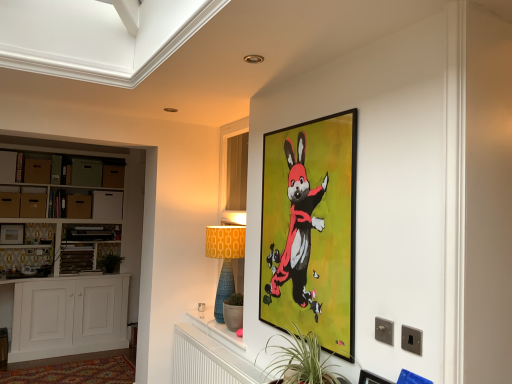
Question: In terms of height, does matte brown drawer at left, the sixth drawer from the right, look taller or shorter compared to green leafy plant at lower center?

Choices:
 (A) short
 (B) tall

Answer: (A)

Question: Looking at their shapes, would you say matte brown drawer at left, acting as the 2th drawer starting from the left, is wider or thinner than green leafy plant at lower center?

Choices:
 (A) thin
 (B) wide

Answer: (B)

Question: Considering the real-world distances, which object is farthest from the blue textured lamp at center?

Choices:
 (A) matte black picture frame at left, which appears as the 3th picture frame when viewed from the right
 (B) matte black picture frame at upper right, arranged as the 1th picture frame when viewed from the front
 (C) matte cardboard drawer at upper left, acting as the third drawer starting from the left
 (D) green leafy plant at lower center
 (E) green cardboard drawer at left, the 5th drawer positioned from the left

Answer: (E)

Question: Which is nearer to the black glossy picture frame at upper right, which ranks as the second picture frame in front-to-back order?

Choices:
 (A) white wood drawer at left, the 2th drawer when ordered from right to left
 (B) matte blue table at lower center
 (C) white wood cabinet at left, the 1th cabinetry when ordered from bottom to top
 (D) matte black picture frame at left, the 1th picture frame viewed from the left
 (E) matte brown drawer at left, which is the 7th drawer in right-to-left order

Answer: (B)